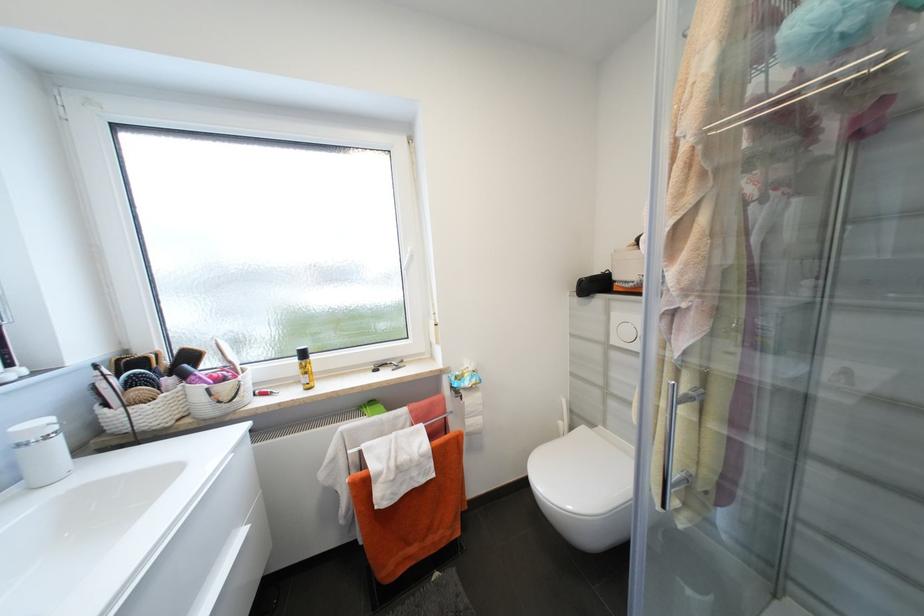
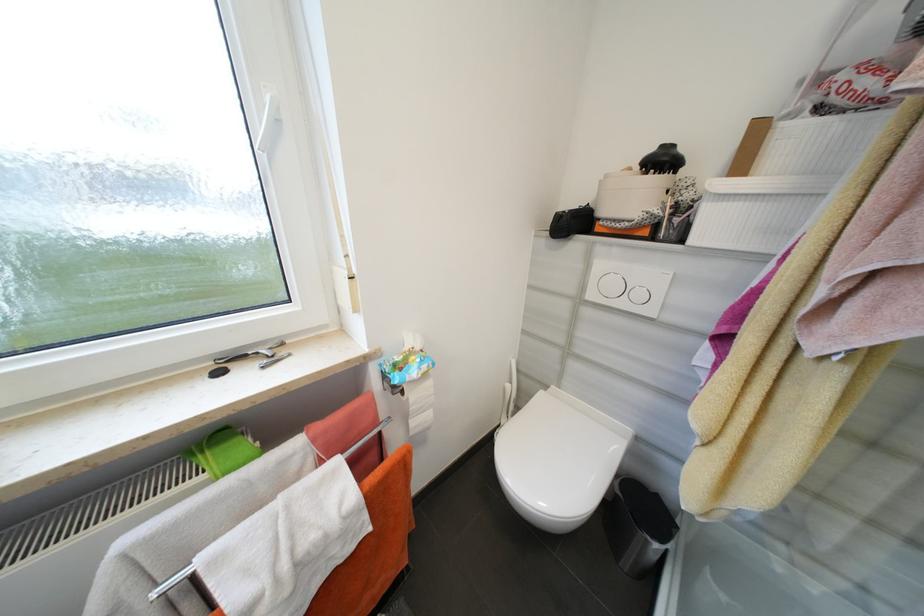
Question: How did the camera likely rotate?

Choices:
 (A) Left
 (B) Right
 (C) Up
 (D) Down

Answer: (B)